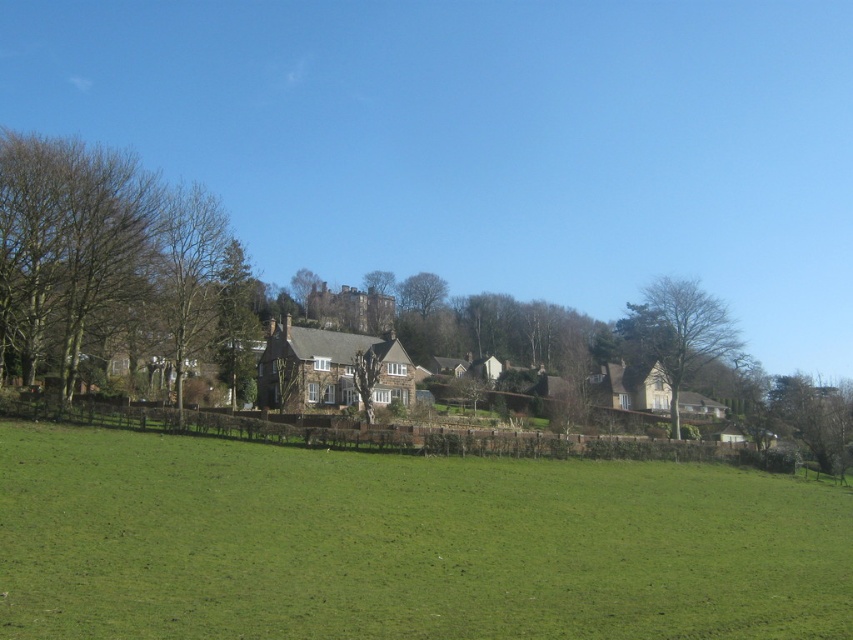
Between green grass at center and green leafy tree at lower right, which one appears on the left side from the viewer's perspective?

green grass at center is more to the left.

Image resolution: width=853 pixels, height=640 pixels. In order to click on green grass at center in this screenshot , I will do `click(404, 545)`.

Identify the location of green grass at center. The image size is (853, 640). point(404,545).

Which is below, green grass at center or brown leafless tree at left?

green grass at center is lower down.

Is green grass at center closer to the viewer compared to brown leafless tree at left?

Yes.

Which is in front, point (544, 461) or point (67, 195)?

Positioned in front is point (544, 461).

Find the location of a particular element. This screenshot has width=853, height=640. green grass at center is located at coordinates (404, 545).

Who is positioned more to the right, bare wood tree at right or green leafy tree at center?

Positioned to the right is bare wood tree at right.

Describe the element at coordinates (677, 332) in the screenshot. Image resolution: width=853 pixels, height=640 pixels. I see `bare wood tree at right` at that location.

Is point (680, 348) positioned after point (241, 264)?

No, it is in front of (241, 264).

Where is `bare wood tree at right`? Image resolution: width=853 pixels, height=640 pixels. bare wood tree at right is located at coordinates (677, 332).